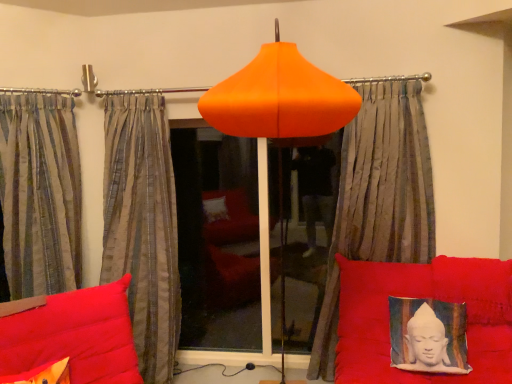
Question: Does silky gray curtain at center, acting as the first curtain starting from the right, lie behind textured fabric cushion with buddha print at lower right?

Choices:
 (A) yes
 (B) no

Answer: (A)

Question: From a real-world perspective, is silky gray curtain at center, acting as the first curtain starting from the right, over textured fabric cushion with buddha print at lower right?

Choices:
 (A) no
 (B) yes

Answer: (B)

Question: Is silky gray curtain at center, acting as the first curtain starting from the right, bigger than textured fabric cushion with buddha print at lower right?

Choices:
 (A) no
 (B) yes

Answer: (B)

Question: Can you confirm if silky gray curtain at center, acting as the first curtain starting from the right, is wider than textured fabric cushion with buddha print at lower right?

Choices:
 (A) yes
 (B) no

Answer: (A)

Question: From the image's perspective, is silky gray curtain at center, marked as the third curtain in a left-to-right arrangement, on textured fabric cushion with buddha print at lower right?

Choices:
 (A) no
 (B) yes

Answer: (B)

Question: Does point (53, 127) appear closer or farther from the camera than point (393, 187)?

Choices:
 (A) farther
 (B) closer

Answer: (A)

Question: Looking at their shapes, would you say striped fabric curtain at left, which appears as the first curtain when viewed from the left, is wider or thinner than silky gray curtain at center, marked as the third curtain in a left-to-right arrangement?

Choices:
 (A) thin
 (B) wide

Answer: (A)

Question: Would you say striped fabric curtain at left, which appears as the first curtain when viewed from the left, is to the left or to the right of silky gray curtain at center, acting as the first curtain starting from the right, in the picture?

Choices:
 (A) right
 (B) left

Answer: (B)

Question: From the image's perspective, is striped fabric curtain at left, which appears as the 3th curtain when viewed from the right, located above or below silky gray curtain at center, marked as the third curtain in a left-to-right arrangement?

Choices:
 (A) below
 (B) above

Answer: (B)

Question: Considering the positions of point (263, 54) and point (24, 117), is point (263, 54) closer or farther from the camera than point (24, 117)?

Choices:
 (A) farther
 (B) closer

Answer: (B)

Question: In the image, is orange matte lampshade at center on the left side or the right side of striped fabric curtain at left, which appears as the 3th curtain when viewed from the right?

Choices:
 (A) right
 (B) left

Answer: (A)

Question: From the image's perspective, is orange matte lampshade at center located above or below striped fabric curtain at left, which appears as the first curtain when viewed from the left?

Choices:
 (A) above
 (B) below

Answer: (B)

Question: Is orange matte lampshade at center taller or shorter than striped fabric curtain at left, which appears as the 3th curtain when viewed from the right?

Choices:
 (A) tall
 (B) short

Answer: (A)

Question: Is orange matte lampshade at center inside or outside of transparent glass window at center?

Choices:
 (A) outside
 (B) inside

Answer: (A)

Question: Is orange matte lampshade at center taller or shorter than transparent glass window at center?

Choices:
 (A) short
 (B) tall

Answer: (B)